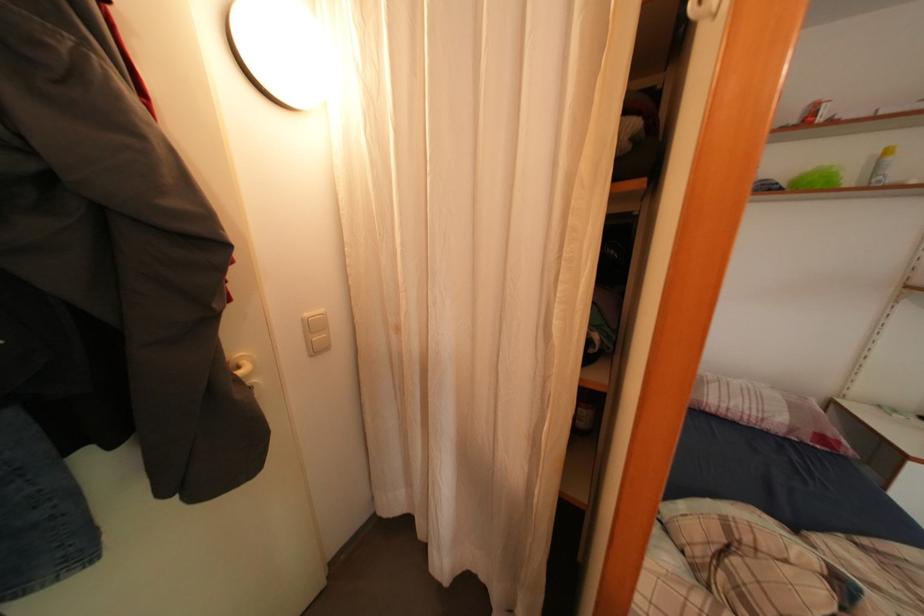
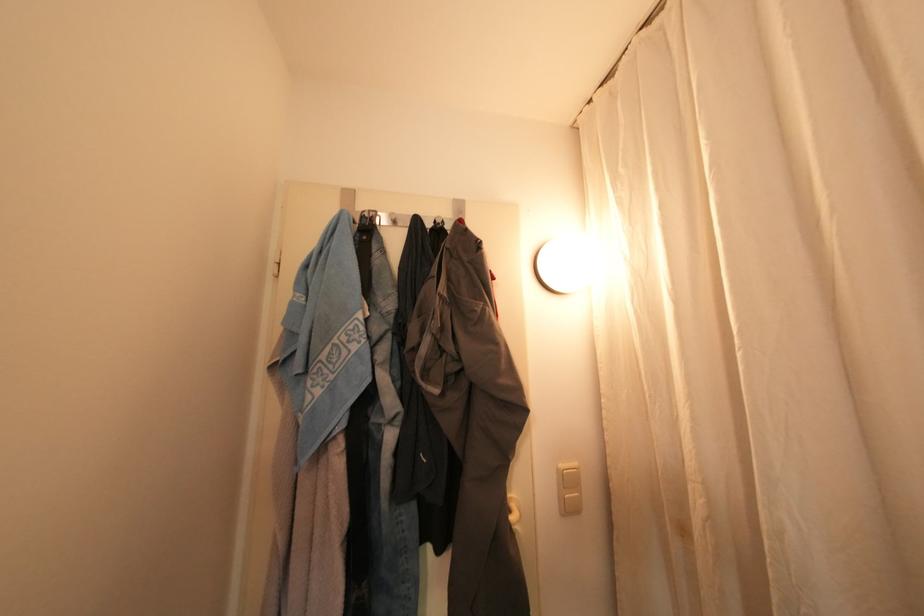
The point at (312, 322) is marked in the first image. Where is the corresponding point in the second image?

(568, 474)